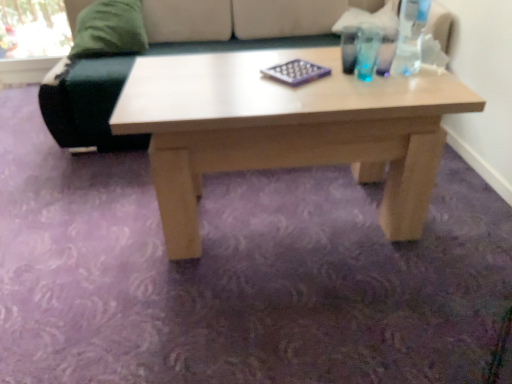
Question: Is the position of purple matte chessboard at center less distant than that of transparent plastic bottle at upper right?

Choices:
 (A) yes
 (B) no

Answer: (B)

Question: Is purple matte chessboard at center smaller than transparent plastic bottle at upper right?

Choices:
 (A) no
 (B) yes

Answer: (B)

Question: Can you confirm if purple matte chessboard at center is thinner than transparent plastic bottle at upper right?

Choices:
 (A) no
 (B) yes

Answer: (A)

Question: Is purple matte chessboard at center positioned behind transparent plastic bottle at upper right?

Choices:
 (A) yes
 (B) no

Answer: (A)

Question: Is purple matte chessboard at center positioned with its back to transparent plastic bottle at upper right?

Choices:
 (A) no
 (B) yes

Answer: (A)

Question: Is transparent plastic bottle at upper right located within purple matte chessboard at center?

Choices:
 (A) no
 (B) yes

Answer: (A)

Question: Is green fabric pillow at upper left looking in the opposite direction of transparent plastic bottle at upper right?

Choices:
 (A) no
 (B) yes

Answer: (A)

Question: Is green fabric pillow at upper left closer to the viewer compared to transparent plastic bottle at upper right?

Choices:
 (A) no
 (B) yes

Answer: (A)

Question: Can you confirm if green fabric pillow at upper left is taller than transparent plastic bottle at upper right?

Choices:
 (A) yes
 (B) no

Answer: (B)

Question: Does green fabric pillow at upper left appear on the left side of transparent plastic bottle at upper right?

Choices:
 (A) no
 (B) yes

Answer: (B)

Question: Is green fabric pillow at upper left far from transparent plastic bottle at upper right?

Choices:
 (A) yes
 (B) no

Answer: (A)

Question: Is green fabric pillow at upper left at the right side of transparent plastic bottle at upper right?

Choices:
 (A) yes
 (B) no

Answer: (B)

Question: From a real-world perspective, is transparent plastic bottle at upper right beneath velvet green couch at upper left?

Choices:
 (A) yes
 (B) no

Answer: (B)